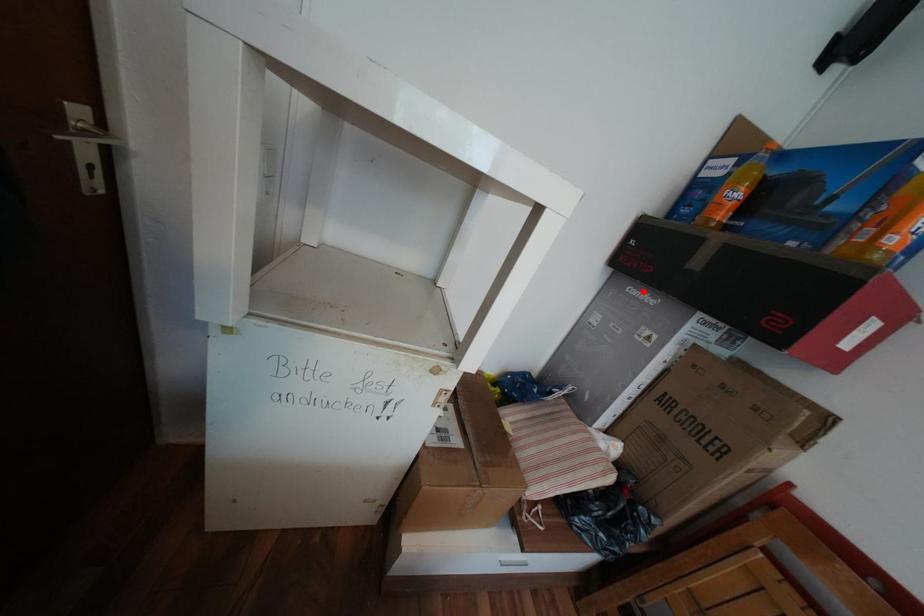
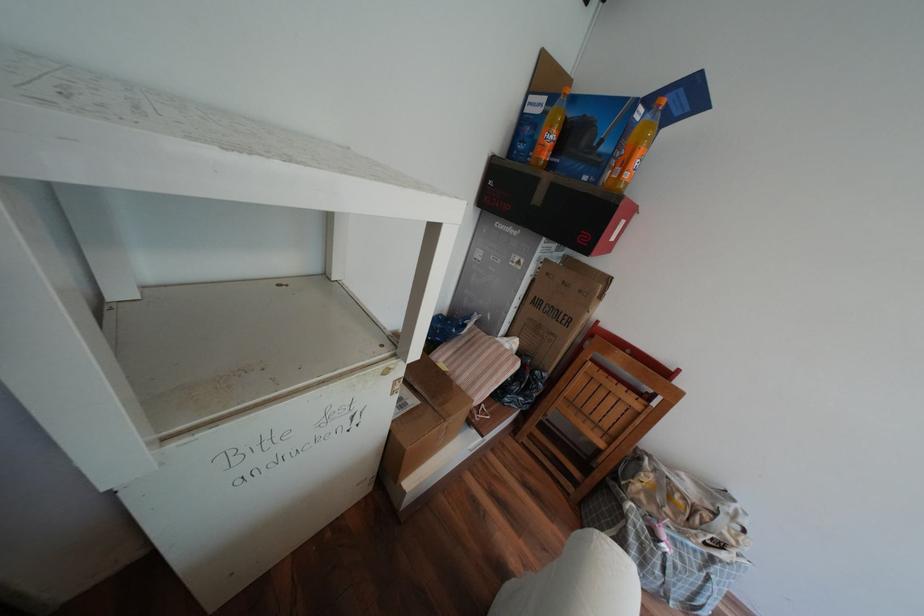
The point at the highlighted location is marked in the first image. Where is the corresponding point in the second image?

(511, 225)